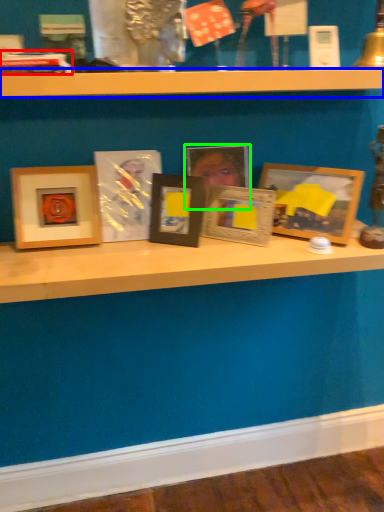
Question: Which object is the farthest from book (highlighted by a red box)? Choose among these: shelf (highlighted by a blue box) or picture frame (highlighted by a green box).

Choices:
 (A) shelf
 (B) picture frame

Answer: (B)